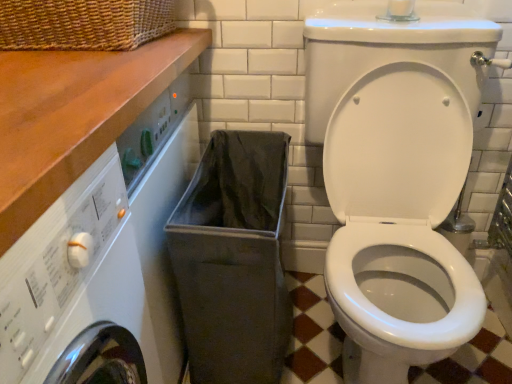
Question: Is gray fabric laundry basket at lower center looking in the opposite direction of wooden at upper left?

Choices:
 (A) yes
 (B) no

Answer: (B)

Question: Considering the relative positions of gray fabric laundry basket at lower center and wooden at upper left in the image provided, is gray fabric laundry basket at lower center behind wooden at upper left?

Choices:
 (A) yes
 (B) no

Answer: (A)

Question: Can you confirm if gray fabric laundry basket at lower center is wider than wooden at upper left?

Choices:
 (A) yes
 (B) no

Answer: (A)

Question: Is the position of gray fabric laundry basket at lower center less distant than that of wooden at upper left?

Choices:
 (A) yes
 (B) no

Answer: (B)

Question: Considering the relative sizes of gray fabric laundry basket at lower center and wooden at upper left in the image provided, is gray fabric laundry basket at lower center bigger than wooden at upper left?

Choices:
 (A) yes
 (B) no

Answer: (A)

Question: From the image's perspective, relative to gray fabric laundry basket at lower center, is wooden at upper left above or below?

Choices:
 (A) above
 (B) below

Answer: (A)

Question: Is point (194, 43) positioned closer to the camera than point (185, 206)?

Choices:
 (A) farther
 (B) closer

Answer: (A)

Question: From a real-world perspective, is wooden at upper left physically located above or below gray fabric laundry basket at lower center?

Choices:
 (A) above
 (B) below

Answer: (A)

Question: Is wooden at upper left taller or shorter than gray fabric laundry basket at lower center?

Choices:
 (A) tall
 (B) short

Answer: (B)

Question: Is gray fabric laundry basket at lower center spatially inside wooden at upper left, or outside of it?

Choices:
 (A) outside
 (B) inside

Answer: (A)

Question: In the image, is gray fabric laundry basket at lower center positioned in front of or behind wooden at upper left?

Choices:
 (A) behind
 (B) front

Answer: (A)

Question: Is point (224, 332) positioned closer to the camera than point (31, 203)?

Choices:
 (A) closer
 (B) farther

Answer: (B)

Question: From the image's perspective, is gray fabric laundry basket at lower center positioned above or below wooden at upper left?

Choices:
 (A) below
 (B) above

Answer: (A)

Question: From a real-world perspective, relative to gray fabric laundry basket at lower center, is white glossy toilet at center vertically above or below?

Choices:
 (A) below
 (B) above

Answer: (B)

Question: Looking at the image, does white glossy toilet at center seem bigger or smaller compared to gray fabric laundry basket at lower center?

Choices:
 (A) big
 (B) small

Answer: (A)